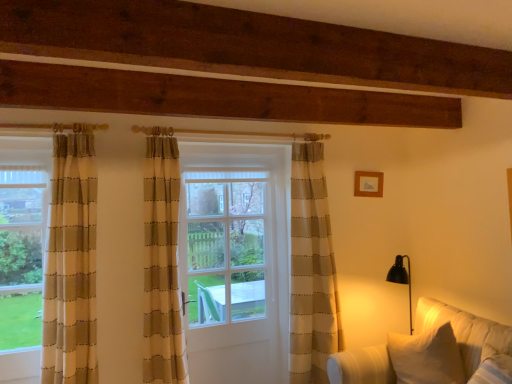
Question: Would you say white fabric couch at lower right is outside clear glass door at center?

Choices:
 (A) no
 (B) yes

Answer: (B)

Question: Are white fabric couch at lower right and clear glass door at center making contact?

Choices:
 (A) no
 (B) yes

Answer: (A)

Question: Is white fabric couch at lower right facing towards clear glass door at center?

Choices:
 (A) yes
 (B) no

Answer: (B)

Question: Considering the relative positions of white fabric couch at lower right and clear glass door at center in the image provided, is white fabric couch at lower right in front of clear glass door at center?

Choices:
 (A) no
 (B) yes

Answer: (B)

Question: Can you confirm if white fabric couch at lower right is wider than clear glass door at center?

Choices:
 (A) yes
 (B) no

Answer: (A)

Question: Is white fabric couch at lower right taller or shorter than clear glass door at center?

Choices:
 (A) short
 (B) tall

Answer: (A)

Question: From the image's perspective, is white fabric couch at lower right above or below clear glass door at center?

Choices:
 (A) below
 (B) above

Answer: (A)

Question: From a real-world perspective, relative to clear glass door at center, is white fabric couch at lower right vertically above or below?

Choices:
 (A) above
 (B) below

Answer: (B)

Question: Is white fabric couch at lower right wider or thinner than clear glass door at center?

Choices:
 (A) wide
 (B) thin

Answer: (A)

Question: Looking at their shapes, would you say wooden picture frame at upper right is wider or thinner than white fabric couch at lower right?

Choices:
 (A) wide
 (B) thin

Answer: (B)

Question: From the image's perspective, is wooden picture frame at upper right located above or below white fabric couch at lower right?

Choices:
 (A) above
 (B) below

Answer: (A)

Question: From a real-world perspective, is wooden picture frame at upper right above or below white fabric couch at lower right?

Choices:
 (A) above
 (B) below

Answer: (A)

Question: Does point (377, 185) appear closer or farther from the camera than point (432, 314)?

Choices:
 (A) farther
 (B) closer

Answer: (A)

Question: Considering their positions, is clear glass door at center located in front of or behind white fabric couch at lower right?

Choices:
 (A) behind
 (B) front

Answer: (A)

Question: From a real-world perspective, relative to white fabric couch at lower right, is clear glass door at center vertically above or below?

Choices:
 (A) below
 (B) above

Answer: (B)